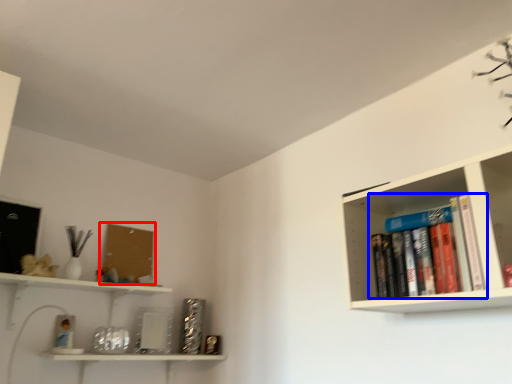
Question: Among these objects, which one is nearest to the camera, book cover (highlighted by a red box) or book (highlighted by a blue box)?

Choices:
 (A) book cover
 (B) book

Answer: (B)